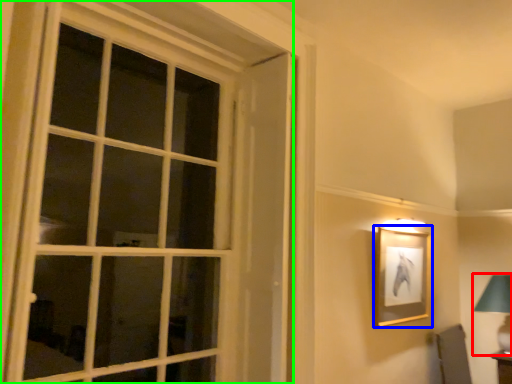
Question: Which is farther away from bedside lamp (highlighted by a red box)? picture frame (highlighted by a blue box) or window (highlighted by a green box)?

Choices:
 (A) picture frame
 (B) window

Answer: (B)